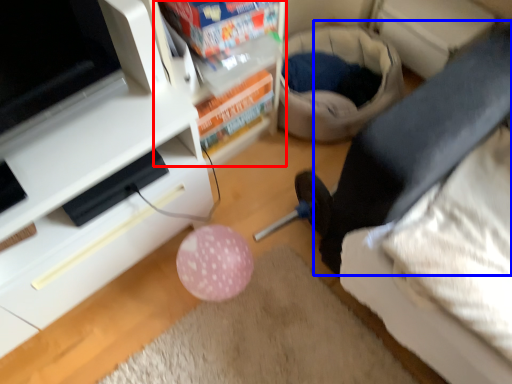
Question: Which object is further to the camera taking this photo, shelf (highlighted by a red box) or leg (highlighted by a blue box)?

Choices:
 (A) shelf
 (B) leg

Answer: (B)